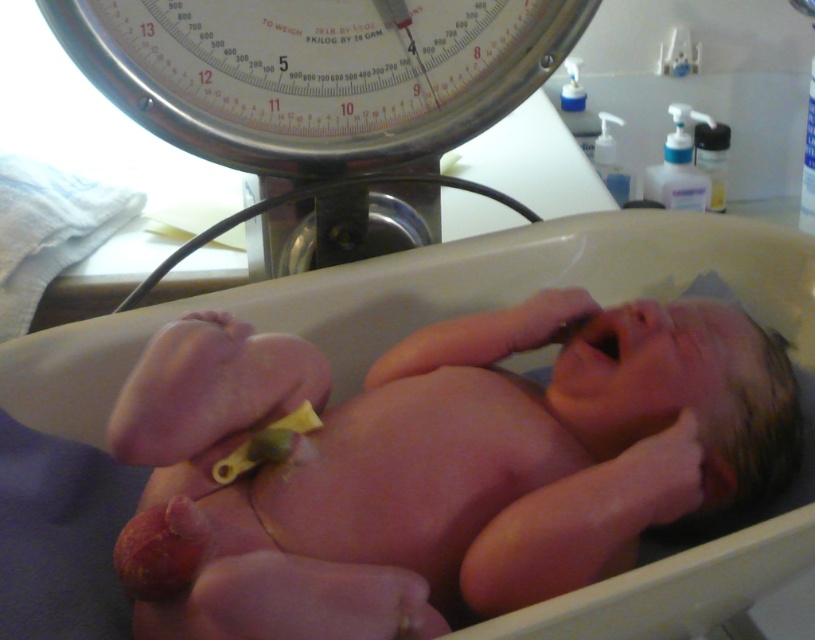
Who is more distant from viewer, (199,429) or (297,156)?

The point (297,156) is more distant.

This screenshot has width=815, height=640. What do you see at coordinates (454, 451) in the screenshot?
I see `pink smooth skin at center` at bounding box center [454, 451].

Does point (771, 444) come farther from viewer compared to point (260, 74)?

No, it is in front of (260, 74).

Locate an element on the screen. This screenshot has width=815, height=640. pink smooth skin at center is located at coordinates (454, 451).